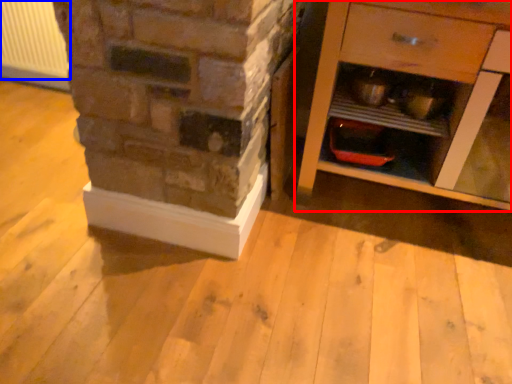
Question: Which object appears farthest to the camera in this image, chest of drawers (highlighted by a red box) or radiator (highlighted by a blue box)?

Choices:
 (A) chest of drawers
 (B) radiator

Answer: (B)